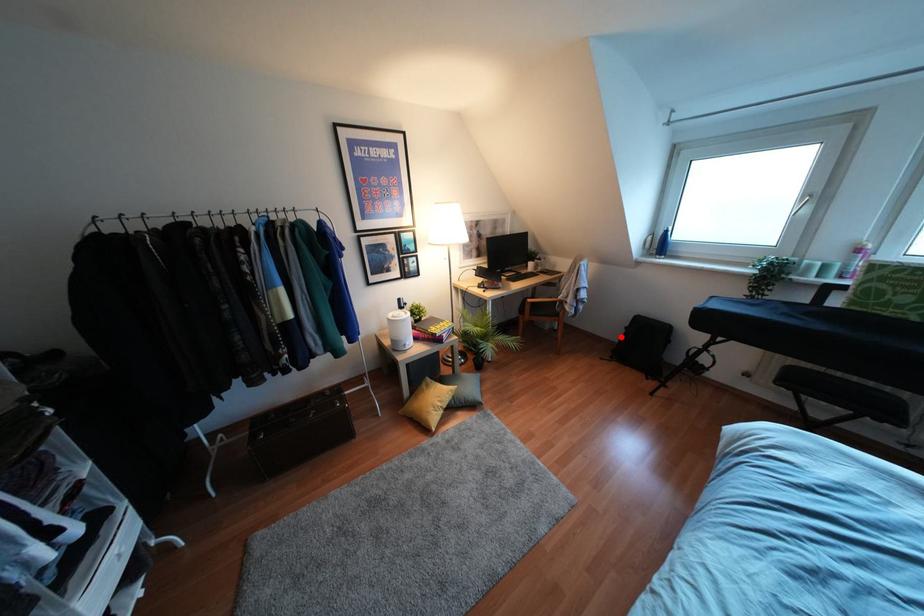
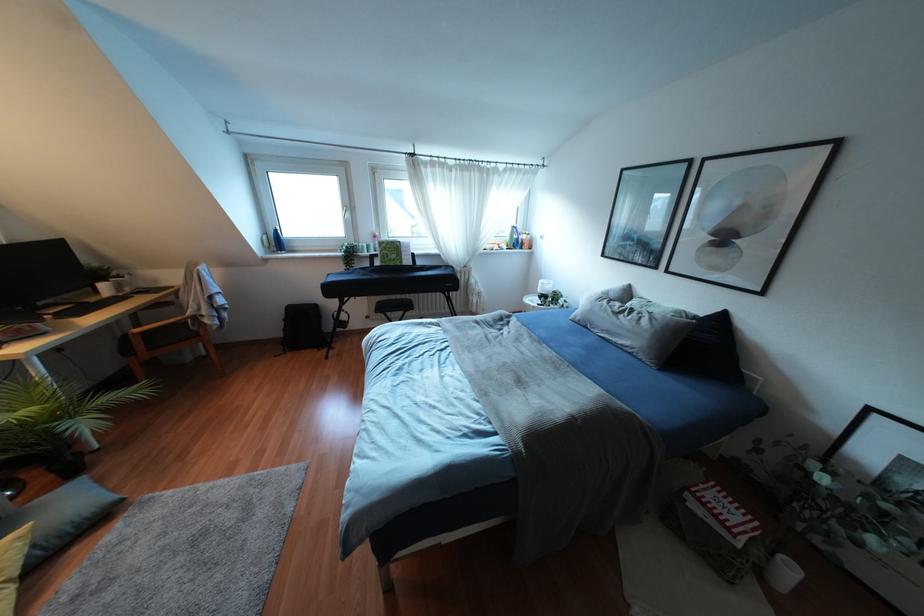
Question: I am providing you with two images of the same scene from different viewpoints. A red point is shown in image1. For the corresponding object point in image2, is it positioned nearer or farther from the camera?

Choices:
 (A) Nearer
 (B) Farther

Answer: (B)